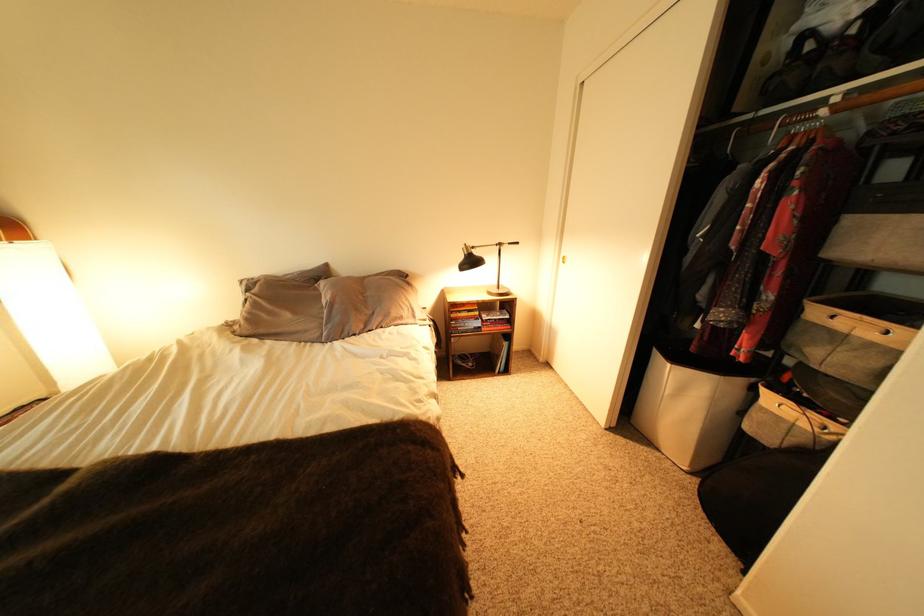
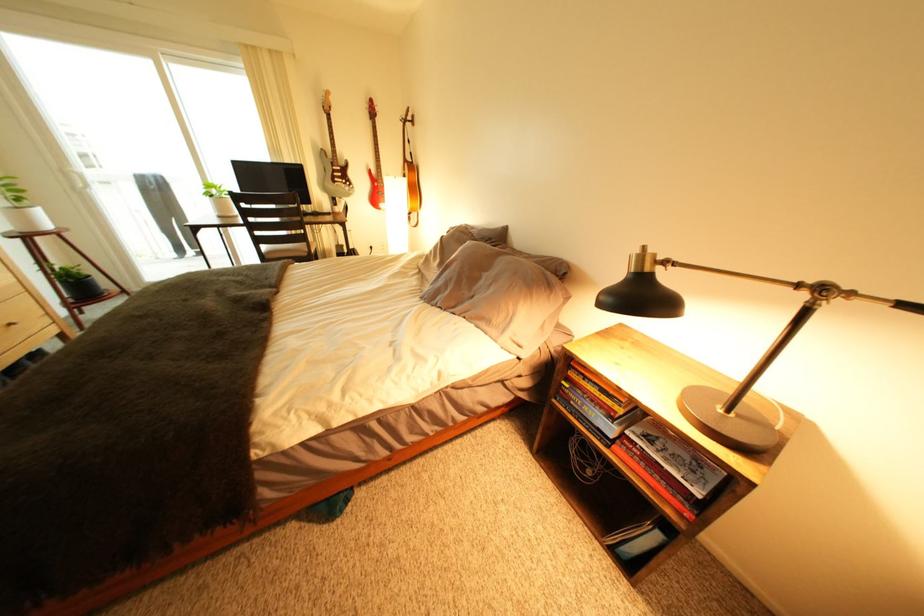
Where in the second image is the point corresponding to pixel 415 320 from the first image?

(503, 323)